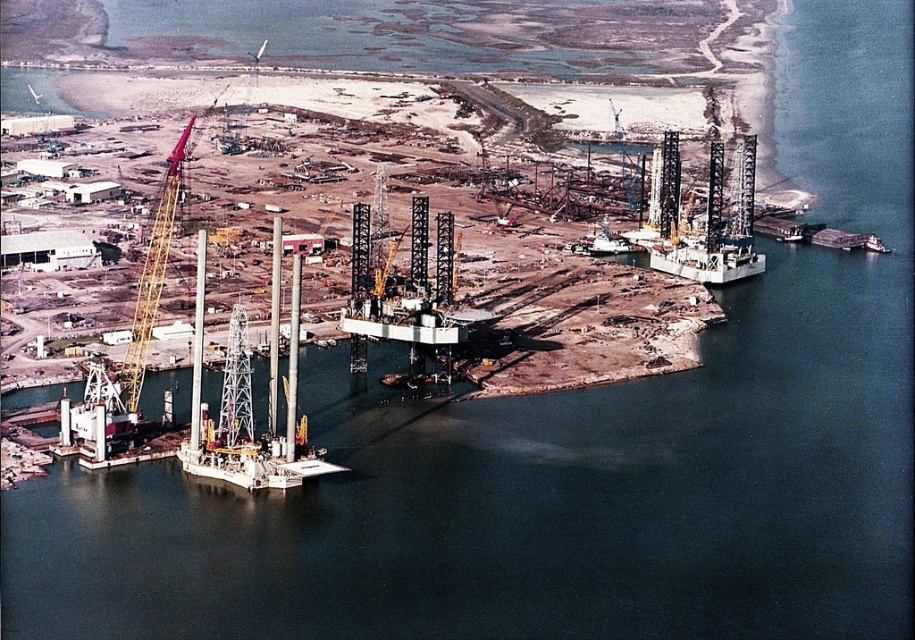
You are a drone operator tasked with capturing aerial footage of the industrial area. You need to ensure that both the yellow metallic crane at left and the metallic gray ship at center are clearly visible in your shot. Given their sizes, which object should you prioritize focusing on to ensure it doesn,t get obscured by other structures?

The yellow metallic crane at left is larger in size than the metallic gray ship at center, so you should prioritize focusing on the yellow metallic crane at left to ensure it doesn,t get obscured by other structures due to its larger size.